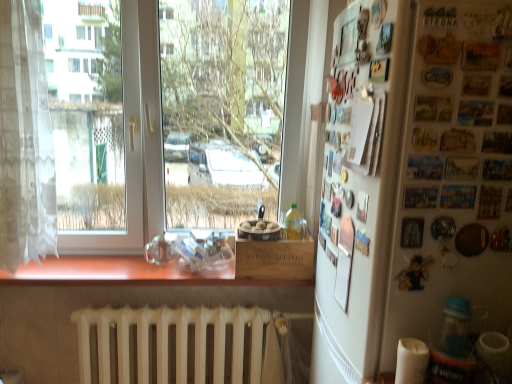
Question: From a real-world perspective, does brown wood at center sit lower than translucent plastic bottle at lower right, which is the 1th bottle in bottom-to-top order?

Choices:
 (A) no
 (B) yes

Answer: (B)

Question: From the image's perspective, would you say brown wood at center is shown under translucent plastic bottle at lower right, marked as the 2th bottle in a top-to-bottom arrangement?

Choices:
 (A) yes
 (B) no

Answer: (B)

Question: From the image's perspective, does brown wood at center appear higher than translucent plastic bottle at lower right, the first bottle from the front?

Choices:
 (A) yes
 (B) no

Answer: (A)

Question: Is brown wood at center placed right next to translucent plastic bottle at lower right, which is the 1th bottle in bottom-to-top order?

Choices:
 (A) no
 (B) yes

Answer: (A)

Question: Could translucent plastic bottle at lower right, the 2th bottle when ordered from back to front, be considered to be inside brown wood at center?

Choices:
 (A) yes
 (B) no

Answer: (B)

Question: Is translucent plastic bottle at lower right, the 2th bottle when ordered from back to front, at the back of brown wood at center?

Choices:
 (A) no
 (B) yes

Answer: (A)

Question: Is white matte refrigerator at right taller than brown wood at center?

Choices:
 (A) yes
 (B) no

Answer: (A)

Question: Could you tell me if white matte refrigerator at right is turned towards brown wood at center?

Choices:
 (A) no
 (B) yes

Answer: (A)

Question: From a real-world perspective, is white matte refrigerator at right located higher than brown wood at center?

Choices:
 (A) yes
 (B) no

Answer: (A)

Question: Is brown wood at center surrounded by white matte refrigerator at right?

Choices:
 (A) no
 (B) yes

Answer: (A)

Question: Considering the relative positions of white matte refrigerator at right and brown wood at center in the image provided, is white matte refrigerator at right behind brown wood at center?

Choices:
 (A) yes
 (B) no

Answer: (B)

Question: Can you confirm if white matte refrigerator at right is thinner than brown wood at center?

Choices:
 (A) yes
 (B) no

Answer: (A)

Question: Considering the relative sizes of white matte radiator at lower center and metallic silver magnets at right in the image provided, is white matte radiator at lower center shorter than metallic silver magnets at right?

Choices:
 (A) yes
 (B) no

Answer: (A)